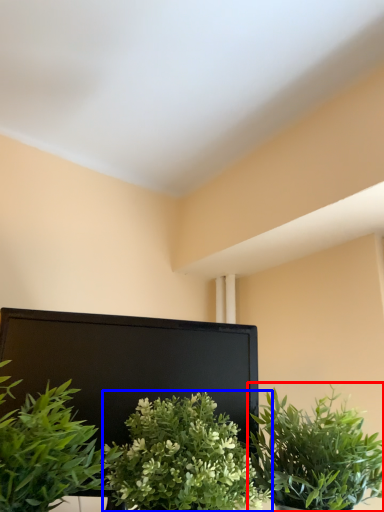
Question: Among these objects, which one is nearest to the camera, houseplant (highlighted by a red box) or houseplant (highlighted by a blue box)?

Choices:
 (A) houseplant
 (B) houseplant

Answer: (B)